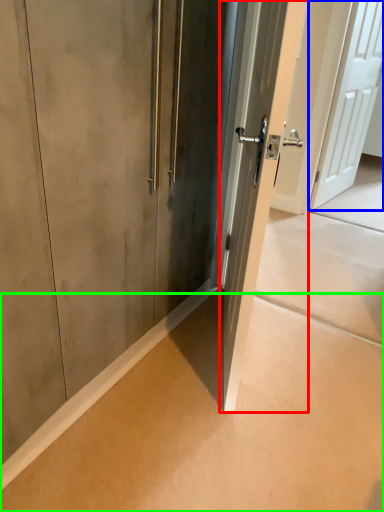
Question: Estimate the real-world distances between objects in this image. Which object is farther from door (highlighted by a red box), door (highlighted by a blue box) or concrete (highlighted by a green box)?

Choices:
 (A) door
 (B) concrete

Answer: (A)